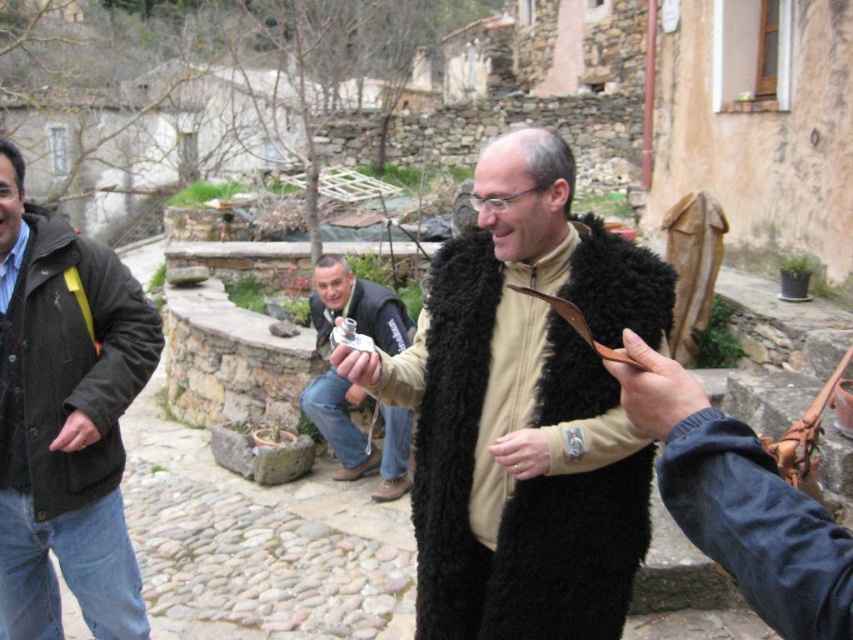
You are a photographer trying to decide between using your metallic silver camera at center and your matte silver watch at center for capturing a quick photo. Since you can only use one, which device should you choose based on their sizes?

The metallic silver camera at center is larger in width than the matte silver watch at center, so you should choose the metallic silver camera at center for capturing the photo as it is designed for photography purposes and is bigger, making it easier to handle.

What is the location of the point with coordinates (654,388) in the scene?

The point with coordinates (654,388) is located on the brown leather hand at center.

You are standing at the origin point in the image and want to move towards the point labeled point (706, 400). Will you pass by point (349, 356) before reaching your destination?

Yes, because point (706, 400) is in front of point (349, 356), so you will pass by point (349, 356) first before reaching your destination.